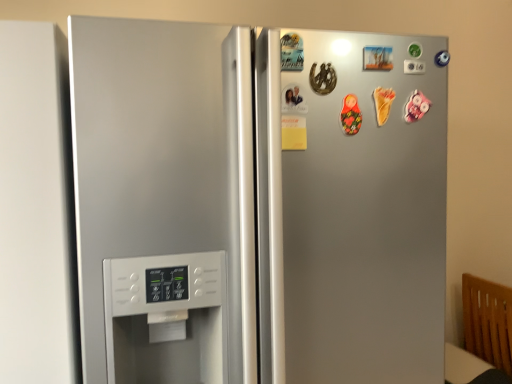
The image size is (512, 384). Identify the location of white matte refrigerator door at left. (37, 209).

In order to face white matte refrigerator door at left, should I rotate leftwards or rightwards?

Rotate left and turn 29.014 degrees.

Measure the distance between point (49, 176) and camera.

The distance of point (49, 176) from camera is 87.70 centimeters.

What do you see at coordinates (37, 209) in the screenshot?
I see `white matte refrigerator door at left` at bounding box center [37, 209].

What is the approximate height of white matte refrigerator door at left?

white matte refrigerator door at left is 3.65 feet in height.

Where is `satin silver refrigerator at center`? satin silver refrigerator at center is located at coordinates (258, 203).

What is the approximate width of satin silver refrigerator at center?

satin silver refrigerator at center is 32.06 inches wide.

The width and height of the screenshot is (512, 384). Describe the element at coordinates (258, 203) in the screenshot. I see `satin silver refrigerator at center` at that location.

Locate an element on the screen. white matte refrigerator door at left is located at coordinates (37, 209).

Considering the relative positions of white matte refrigerator door at left and satin silver refrigerator at center in the image provided, is white matte refrigerator door at left to the left of satin silver refrigerator at center from the viewer's perspective?

Yes, white matte refrigerator door at left is to the left of satin silver refrigerator at center.

Which object is closer to the camera, white matte refrigerator door at left or satin silver refrigerator at center?

satin silver refrigerator at center.

Is point (16, 362) positioned behind point (88, 368)?

Yes.

From the image's perspective, is white matte refrigerator door at left located beneath satin silver refrigerator at center?

No.

From a real-world perspective, is white matte refrigerator door at left positioned over satin silver refrigerator at center based on gravity?

Yes, from a real-world perspective, white matte refrigerator door at left is on top of satin silver refrigerator at center.

Considering the sizes of objects white matte refrigerator door at left and satin silver refrigerator at center in the image provided, who is thinner, white matte refrigerator door at left or satin silver refrigerator at center?

white matte refrigerator door at left is thinner.

In terms of height, does white matte refrigerator door at left look taller or shorter compared to satin silver refrigerator at center?

Considering their sizes, white matte refrigerator door at left has less height than satin silver refrigerator at center.

Can you confirm if white matte refrigerator door at left is smaller than satin silver refrigerator at center?

Indeed, white matte refrigerator door at left has a smaller size compared to satin silver refrigerator at center.

Is satin silver refrigerator at center a part of white matte refrigerator door at left?

No, satin silver refrigerator at center is not surrounded by white matte refrigerator door at left.

Is white matte refrigerator door at left positioned far away from satin silver refrigerator at center?

white matte refrigerator door at left is near satin silver refrigerator at center, not far away.

Is white matte refrigerator door at left facing towards satin silver refrigerator at center?

No, white matte refrigerator door at left is not turned towards satin silver refrigerator at center.

At what (x,y) coordinates should I click in order to perform the action: click on refrigerator located on the right of white matte refrigerator door at left. Please return your answer as a coordinate pair (x, y). The height and width of the screenshot is (384, 512). Looking at the image, I should click on (258, 203).

Does satin silver refrigerator at center appear on the right side of white matte refrigerator door at left?

Correct, you'll find satin silver refrigerator at center to the right of white matte refrigerator door at left.

Considering their positions, is satin silver refrigerator at center located in front of or behind white matte refrigerator door at left?

satin silver refrigerator at center is in front of white matte refrigerator door at left.

Which is behind, point (140, 139) or point (0, 248)?

The point (140, 139) is behind.

From the image's perspective, is satin silver refrigerator at center located beneath white matte refrigerator door at left?

Yes.

From a real-world perspective, between satin silver refrigerator at center and white matte refrigerator door at left, who is vertically higher?

white matte refrigerator door at left is physically above.

Looking at their sizes, would you say satin silver refrigerator at center is wider or thinner than white matte refrigerator door at left?

satin silver refrigerator at center is wider than white matte refrigerator door at left.

Which of these two, satin silver refrigerator at center or white matte refrigerator door at left, stands taller?

satin silver refrigerator at center.

Is satin silver refrigerator at center smaller than white matte refrigerator door at left?

No, satin silver refrigerator at center is not smaller than white matte refrigerator door at left.

Is satin silver refrigerator at center outside of white matte refrigerator door at left?

satin silver refrigerator at center is positioned outside white matte refrigerator door at left.

Are satin silver refrigerator at center and white matte refrigerator door at left beside each other?

There is a gap between satin silver refrigerator at center and white matte refrigerator door at left.

Is white matte refrigerator door at left at the back of satin silver refrigerator at center?

No, satin silver refrigerator at center's orientation is not away from white matte refrigerator door at left.

How different are the orientations of satin silver refrigerator at center and white matte refrigerator door at left in degrees?

The facing directions of satin silver refrigerator at center and white matte refrigerator door at left are 0.000384 degrees apart.

You are a GUI agent. You are given a task and a screenshot of the screen. Output one action in this format:
    pyautogui.click(x=<x>, y=<y>)
    Task: Click on the door lying on the left of satin silver refrigerator at center
    The height and width of the screenshot is (384, 512).
    Given the screenshot: What is the action you would take?
    pyautogui.click(x=37, y=209)

I want to click on refrigerator in front of the white matte refrigerator door at left, so click(x=258, y=203).

You are a GUI agent. You are given a task and a screenshot of the screen. Output one action in this format:
    pyautogui.click(x=<x>, y=<y>)
    Task: Click on the door above the satin silver refrigerator at center (from the image's perspective)
    
    Given the screenshot: What is the action you would take?
    pyautogui.click(x=37, y=209)